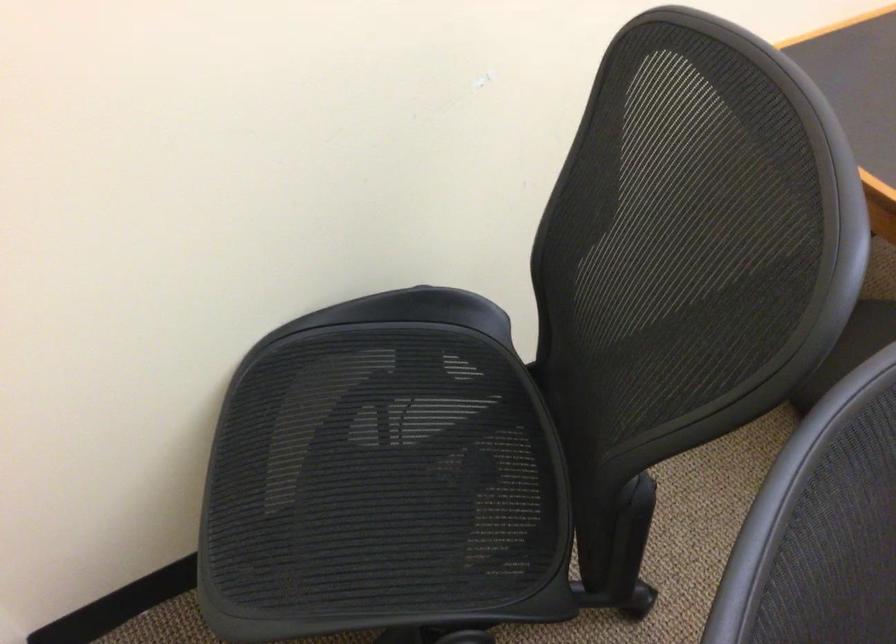
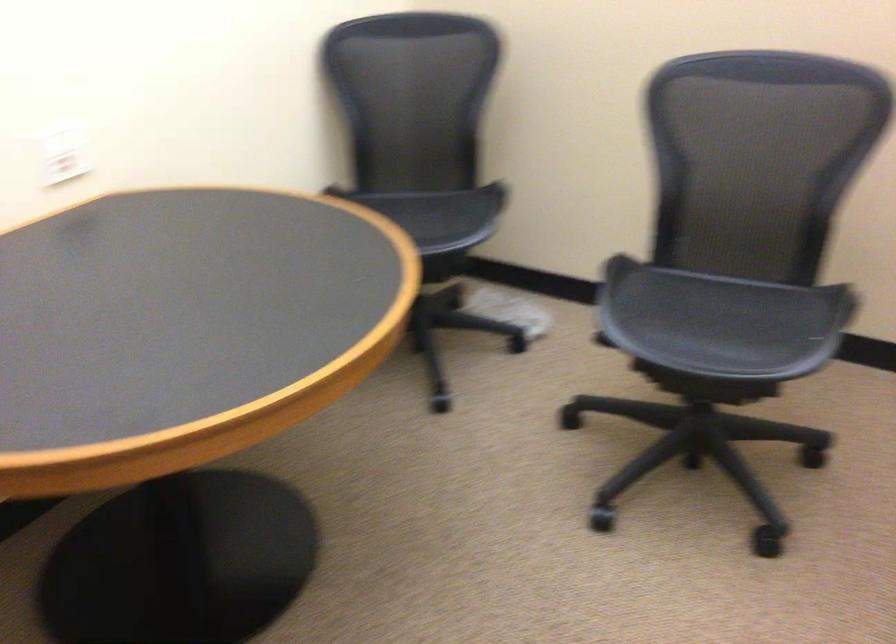
Question: The images are taken continuously from a first-person perspective. In which direction are you moving?

Choices:
 (A) Left
 (B) Right
 (C) Forward
 (D) Backward

Answer: (B)